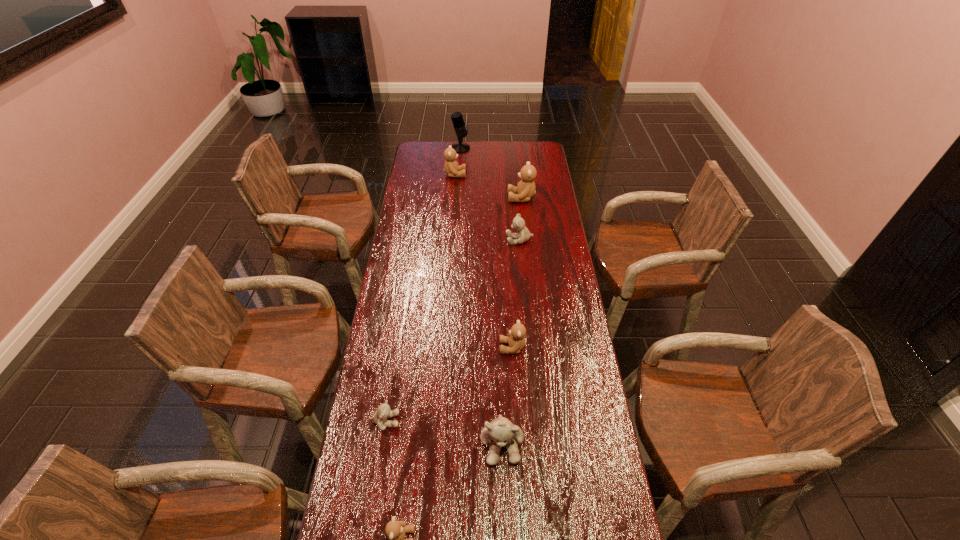
This screenshot has width=960, height=540. Find the location of `microphone`. microphone is located at coordinates (457, 119).

Identify the location of black microphone. The image size is (960, 540). (457, 119).

Identify the location of the second tallest object. This screenshot has height=540, width=960. (525, 189).

Find the location of `the tallest teddy bear`. the tallest teddy bear is located at coordinates (525, 189).

Find the location of a particular element. The image size is (960, 540). the farthest teddy bear is located at coordinates (451, 167).

The height and width of the screenshot is (540, 960). I want to click on the third smallest brown teddy bear, so point(451,167).

Where is `the biggest gray teddy bear`? the biggest gray teddy bear is located at coordinates tap(500, 432).

The width and height of the screenshot is (960, 540). I want to click on the second nearest brown teddy bear, so click(x=516, y=341).

Where is `the second smallest brown teddy bear`? The width and height of the screenshot is (960, 540). the second smallest brown teddy bear is located at coordinates (516, 341).

At what (x,y) coordinates should I click in order to perform the action: click on the farthest gray teddy bear. Please return your answer as a coordinate pair (x, y). Looking at the image, I should click on (523, 235).